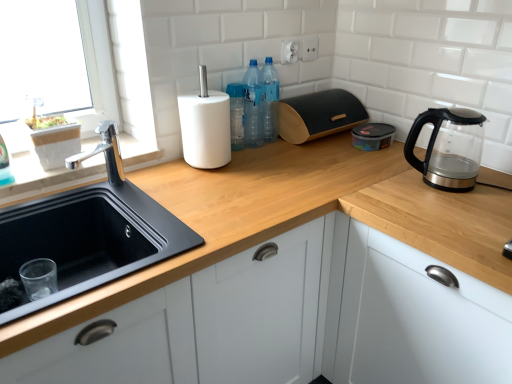
Locate an element on the screen. This screenshot has height=384, width=512. vacant space in front of transparent glass kettle at right is located at coordinates (457, 198).